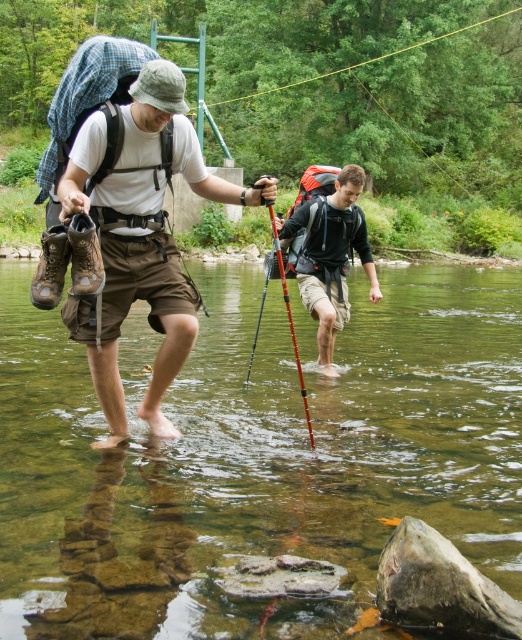
You are a hiker planning to cross the shallow river. You see the clear water at center and the matte brown shorts at center. How far apart are these two items?

The clear water at center is 10.85 feet away from the matte brown shorts at center.

You are a hiker trying to cross the river. You have a matte brown shorts at center and a red plastic pole at center. Which item is closer to the river surface?

The matte brown shorts at center is located below the red plastic pole at center, so the red plastic pole at center is closer to the river surface.